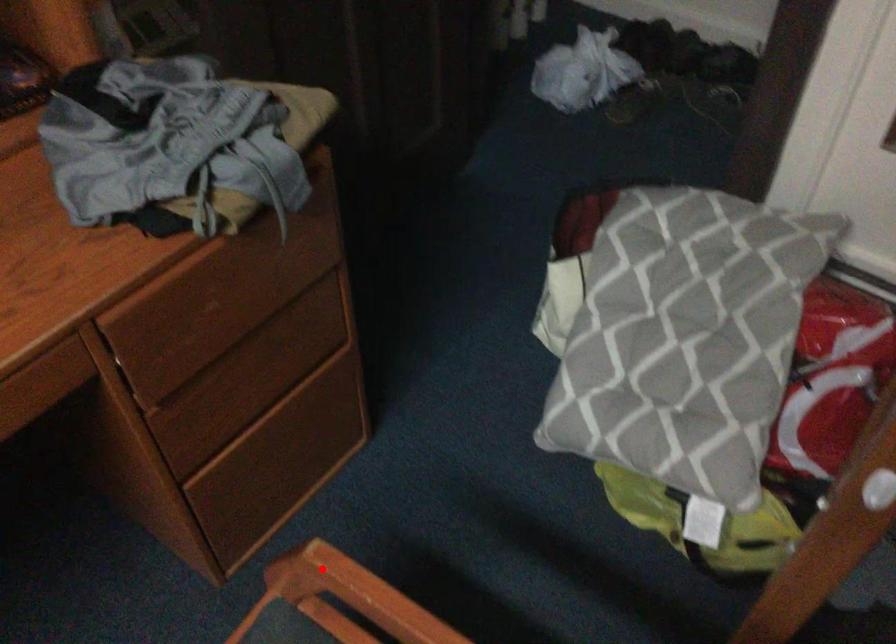
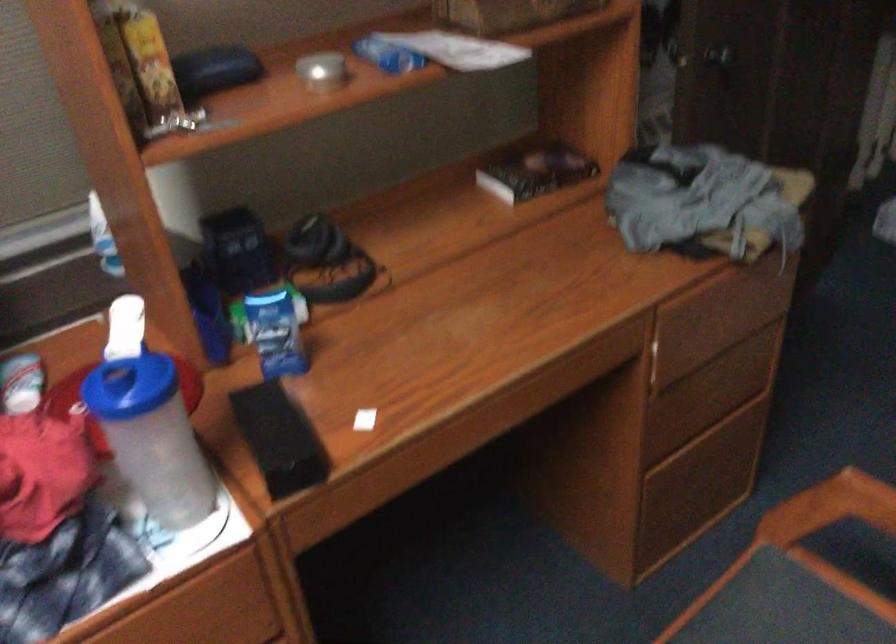
Find the pixel in the second image that matches the highlighted location in the first image.

(830, 507)